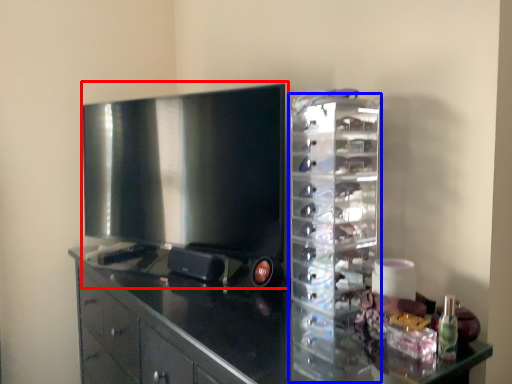
Question: Among these objects, which one is farthest to the camera, home appliance (highlighted by a red box) or glass box (highlighted by a blue box)?

Choices:
 (A) home appliance
 (B) glass box

Answer: (A)